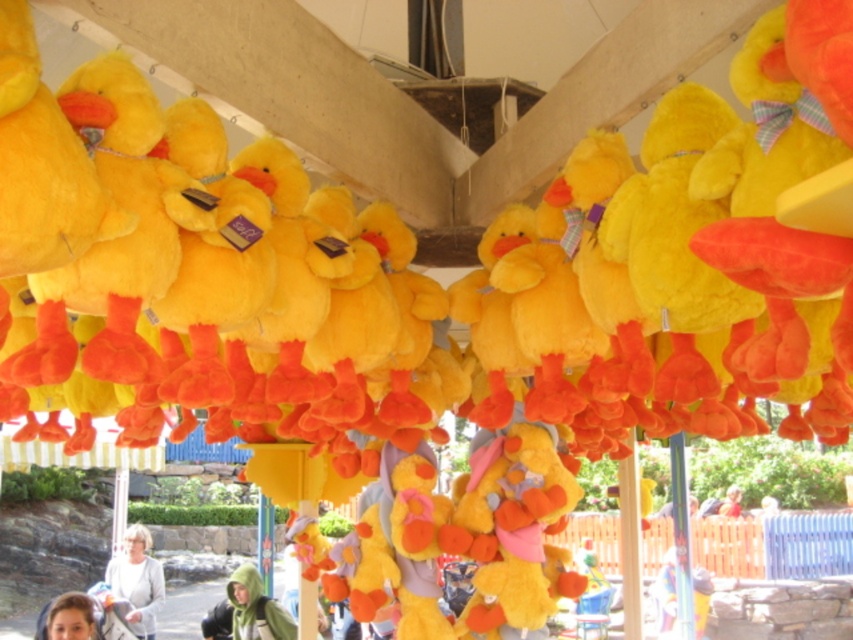
Question: Does matte green hoodie at lower center lie in front of matte gray sweater at lower left?

Choices:
 (A) no
 (B) yes

Answer: (B)

Question: Which object is closer to the camera taking this photo?

Choices:
 (A) matte gray sweater at lower left
 (B) smooth skin face at lower left
 (C) matte green hoodie at lower center

Answer: (B)

Question: Which point is farther to the camera?

Choices:
 (A) (155, 612)
 (B) (74, 593)
 (C) (241, 579)

Answer: (A)

Question: Can you confirm if matte green hoodie at lower center is positioned to the left of smooth skin face at lower left?

Choices:
 (A) no
 (B) yes

Answer: (A)

Question: Which of the following is the farthest from the observer?

Choices:
 (A) [115, 564]
 (B) [248, 584]

Answer: (A)

Question: Is matte green hoodie at lower center closer to camera compared to smooth skin face at lower left?

Choices:
 (A) yes
 (B) no

Answer: (B)